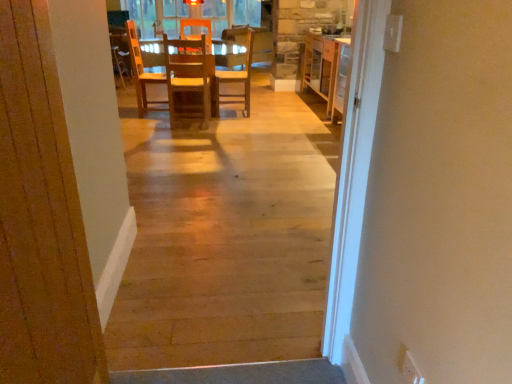
Question: Is wooden cabinet at center bigger or smaller than natural wood floor at center?

Choices:
 (A) small
 (B) big

Answer: (B)

Question: Is wooden cabinet at center taller or shorter than natural wood floor at center?

Choices:
 (A) tall
 (B) short

Answer: (B)

Question: Estimate the real-world distances between objects in this image. Which object is farther from the wooden armchair at upper left?

Choices:
 (A) wooden door at center
 (B) natural wood floor at center
 (C) wooden chair at center, acting as the first chair starting from the right
 (D) wooden chair at center, acting as the 2th chair starting from the right
 (E) wooden cabinet at center

Answer: (A)

Question: Which of these objects is positioned closest to the natural wood floor at center?

Choices:
 (A) wooden chair at center, acting as the first chair starting from the right
 (B) wooden armchair at upper left
 (C) wooden cabinet at center
 (D) wooden door at center
 (E) wooden chair at center, acting as the 2th chair starting from the right

Answer: (D)